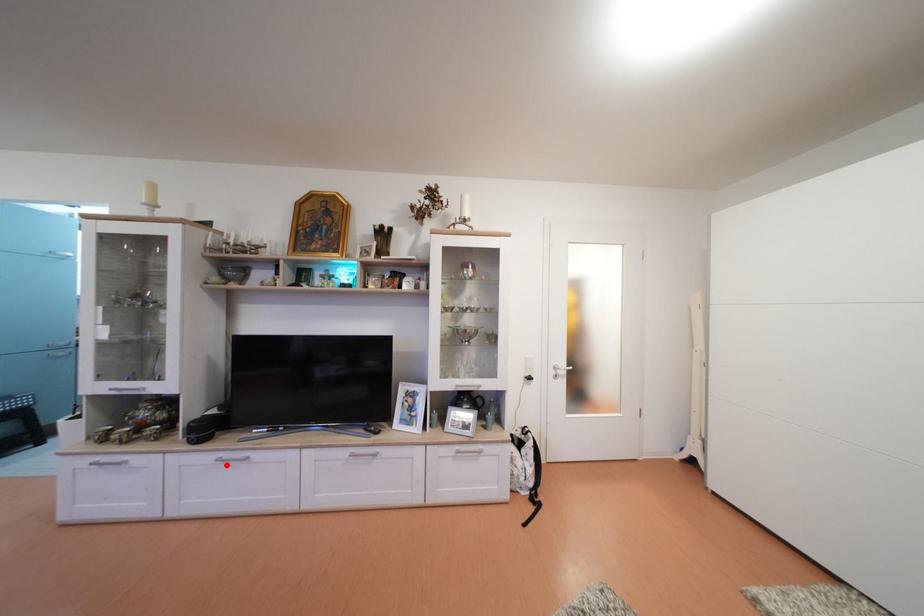
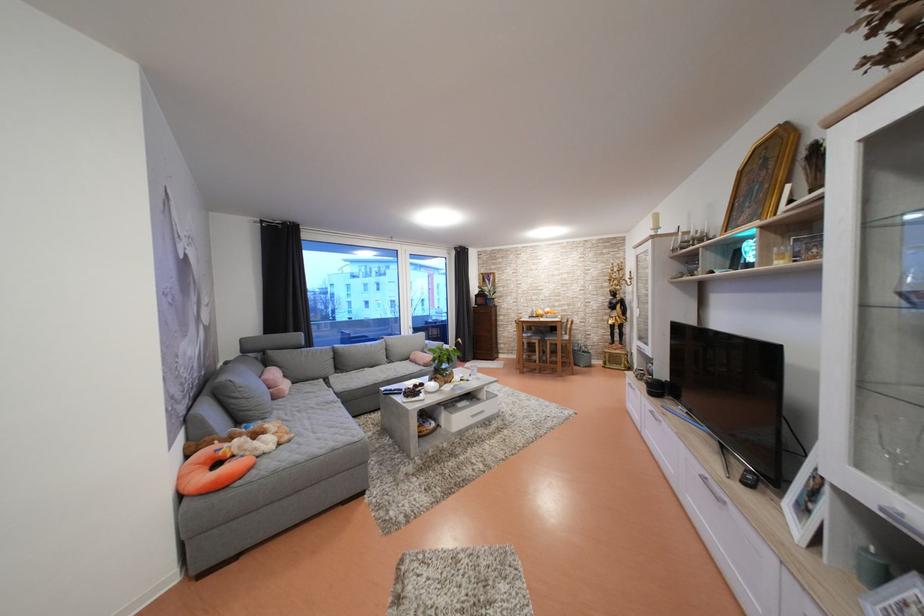
In the second image, find the point that corresponds to the highlighted location in the first image.

(659, 416)